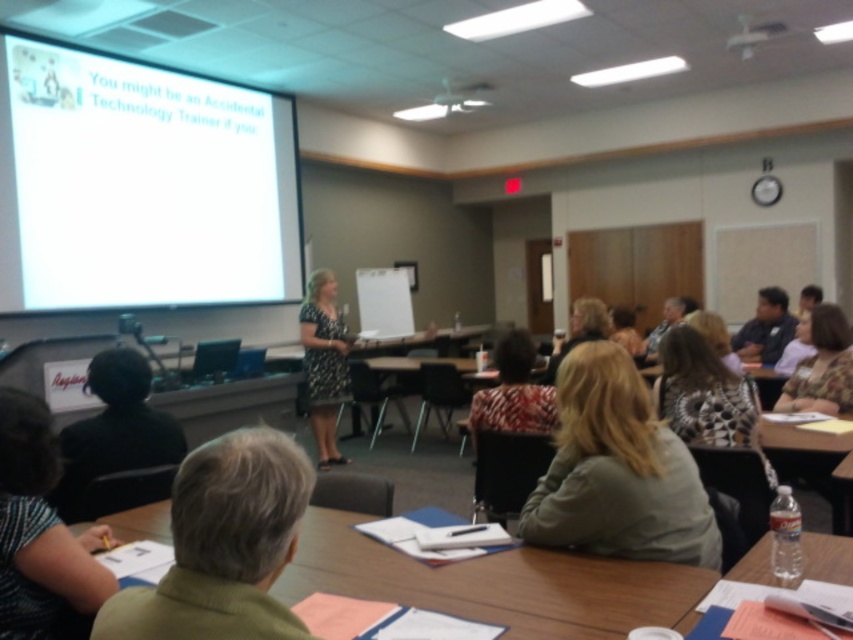
You are organizing a classroom and need to place a laptop on the green fabric table at lower center and a water bottle on the clear plastic bottle at lower right. Which object should you place first if you want to follow the left to right order?

You should place the laptop on the green fabric table at lower center first because it is to the left of the clear plastic bottle at lower right, following the left to right order.